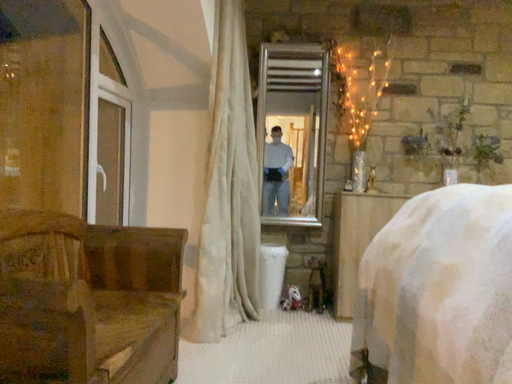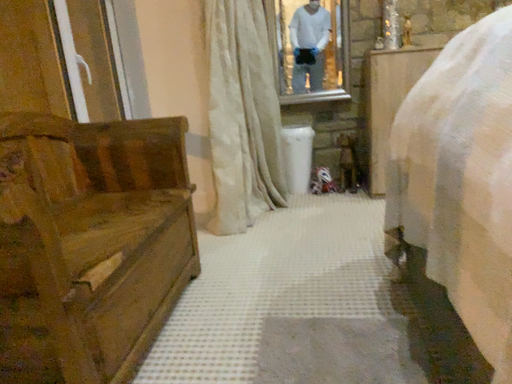
Question: How did the camera likely rotate when shooting the video?

Choices:
 (A) rotated downward
 (B) rotated upward

Answer: (A)